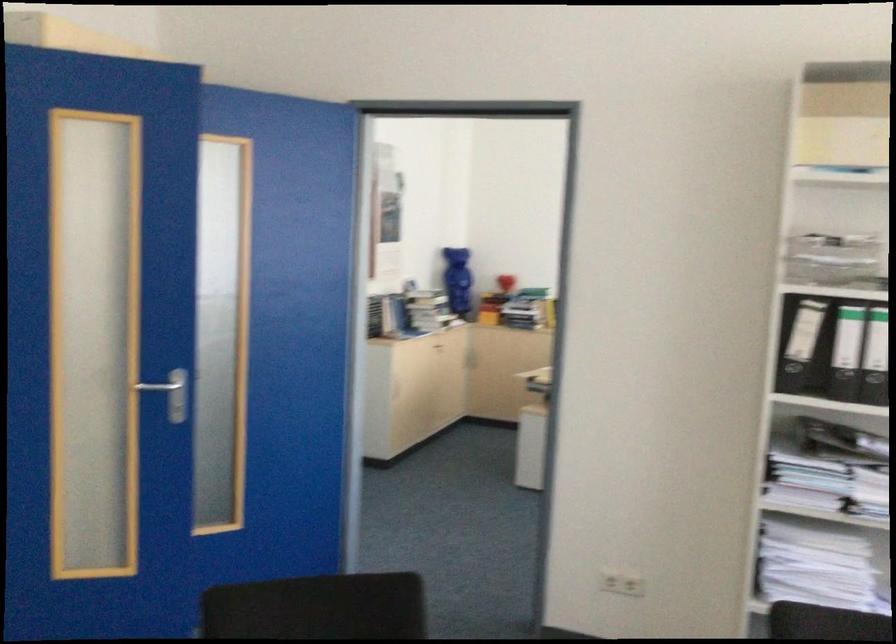
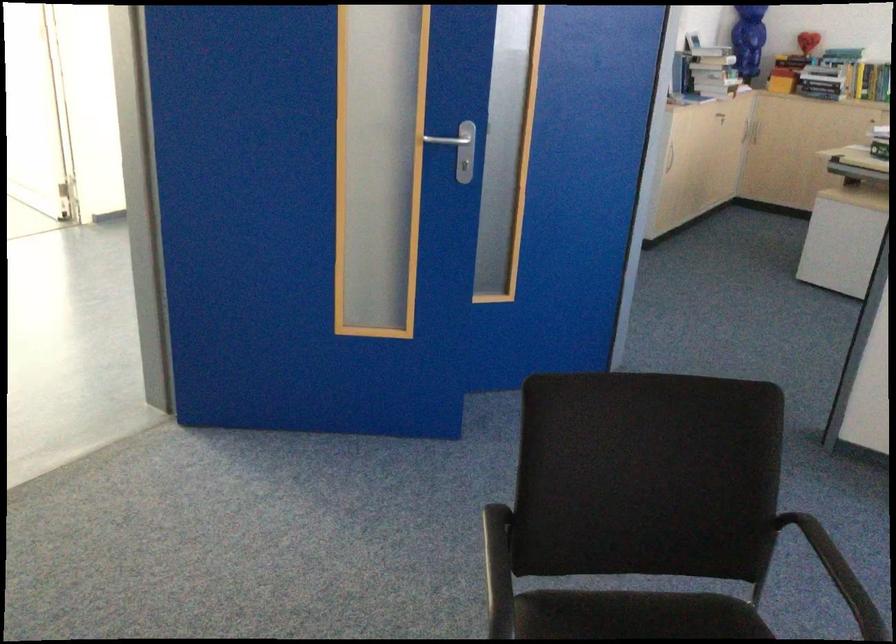
Question: The images are taken continuously from a first-person perspective. In which direction is your viewpoint rotating?

Choices:
 (A) Left
 (B) Right
 (C) Up
 (D) Down

Answer: (D)